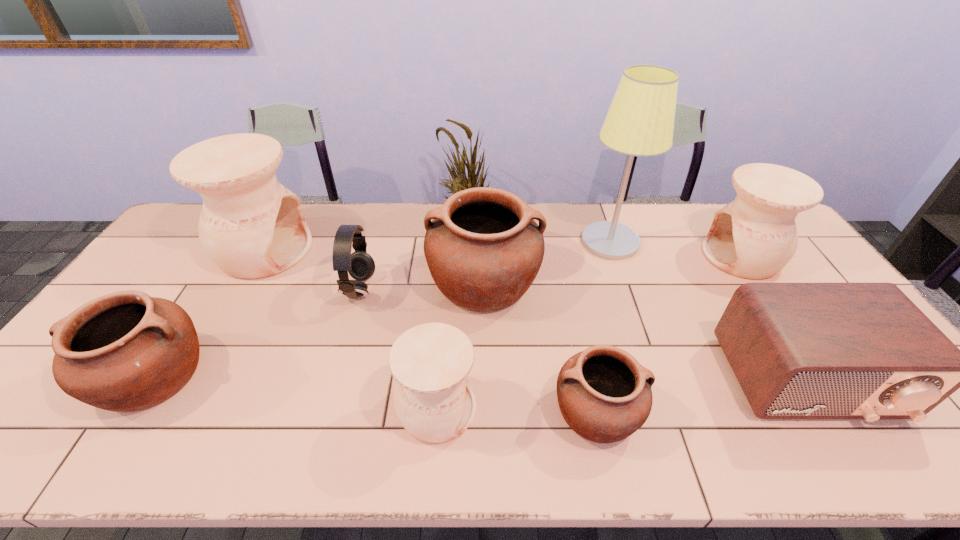
The width and height of the screenshot is (960, 540). Identify the location of object at the far right corner. (755, 236).

Image resolution: width=960 pixels, height=540 pixels. What are the coordinates of `object positioned at the near right corner` in the screenshot? It's located at (865, 351).

I want to click on vacant space at the far edge of the desktop, so click(344, 213).

The height and width of the screenshot is (540, 960). I want to click on vacant space at the near edge of the desktop, so click(122, 432).

The height and width of the screenshot is (540, 960). Identify the location of vacant area at the left edge. (193, 248).

The width and height of the screenshot is (960, 540). In order to click on vacant space that is in between the biggest cream pottery and the radio receiver in this screenshot , I will do `click(536, 315)`.

This screenshot has width=960, height=540. Find the location of `free space between the rightmost pottery and the table lamp`. free space between the rightmost pottery and the table lamp is located at coordinates (676, 249).

Identify the location of free spot between the second biggest reddish pottery and the table lamp. Image resolution: width=960 pixels, height=540 pixels. (381, 309).

Identify the location of vacant space that is in between the tallest object and the radio receiver. This screenshot has width=960, height=540. (708, 311).

The width and height of the screenshot is (960, 540). What are the coordinates of `vacant space that is in between the radio receiver and the black earphone` in the screenshot? It's located at (584, 335).